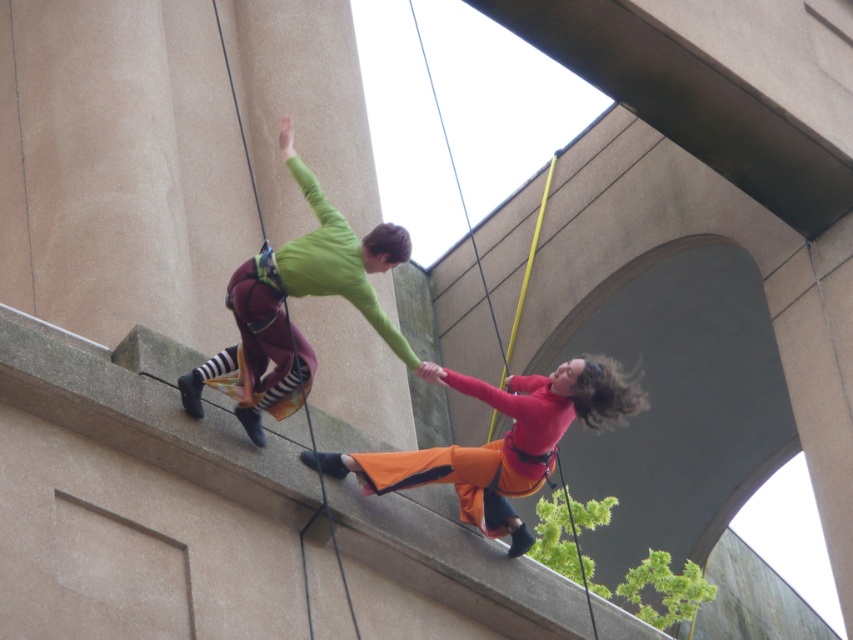
Which is above, matte green long-sleeve shirt at upper center or orange fabric pants at lower center?

matte green long-sleeve shirt at upper center is higher up.

Identify the location of matte green long-sleeve shirt at upper center. This screenshot has width=853, height=640. (297, 296).

Which is above, green fabric climbing harness at upper center or orange fabric pants at lower center?

Positioned higher is green fabric climbing harness at upper center.

Between point (459, 372) and point (508, 403), which one is positioned in front?

Point (508, 403) is more forward.

What are the coordinates of `green fabric climbing harness at upper center` in the screenshot? It's located at (527, 433).

Is green fabric climbing harness at upper center shorter than matte green long-sleeve shirt at upper center?

No, green fabric climbing harness at upper center is not shorter than matte green long-sleeve shirt at upper center.

Is green fabric climbing harness at upper center smaller than matte green long-sleeve shirt at upper center?

No, green fabric climbing harness at upper center is not smaller than matte green long-sleeve shirt at upper center.

Between point (316, 461) and point (265, 266), which one is positioned behind?

The point (265, 266) is behind.

At what (x,y) coordinates should I click in order to perform the action: click on green fabric climbing harness at upper center. Please return your answer as a coordinate pair (x, y). The width and height of the screenshot is (853, 640). Looking at the image, I should click on (527, 433).